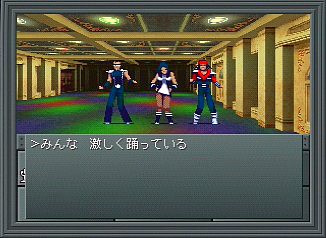
I want to click on blue spots in floor, so click(x=37, y=126), click(x=232, y=130), click(x=136, y=111), click(x=93, y=101), click(x=185, y=103).